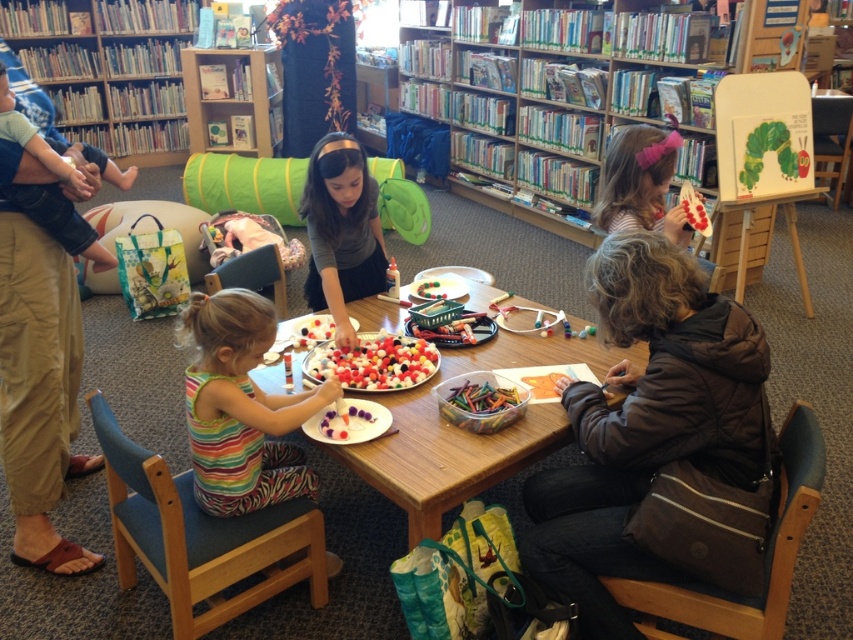
You are a parent trying to reach the smooth plastic beads at center for your child. There is a brown fuzzy jacket at lower right in the way. Can you easily access the beads?

The brown fuzzy jacket at lower right is taller than smooth plastic beads at center, so it might block your access to the beads. You may need to move the jacket first.

You are a child trying to reach the white glossy beads at center without moving from your spot. Which direction should you move your hand to reach them from the brown fuzzy jacket at lower right?

Since the brown fuzzy jacket at lower right is to the right of the white glossy beads at center, you should move your hand to the left to reach the white glossy beads at center from the brown fuzzy jacket at lower right.

In the scene shown: You are standing at point (x=708, y=365) and want to walk to the craft table. The path is clear except for a small stool placed exactly halfway between you and the table. Can you step around it without moving the stool?

The distance between you and the craft table is 5.45 feet. Since the stool is halfway, it is 2.725 feet away from you. As long as you can maneuver around the stool within that distance, you should be able to reach the table without moving it.